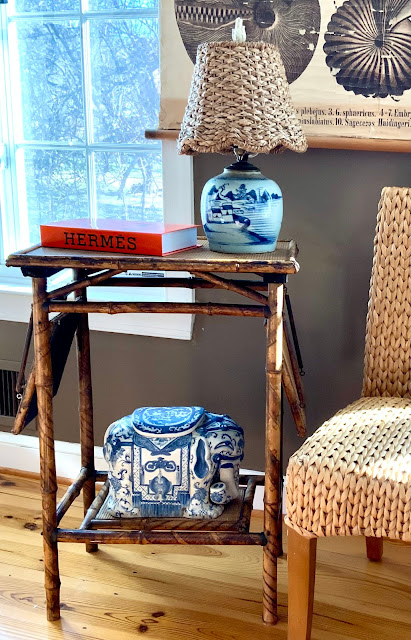
I want to click on lamp, so coord(264,180).